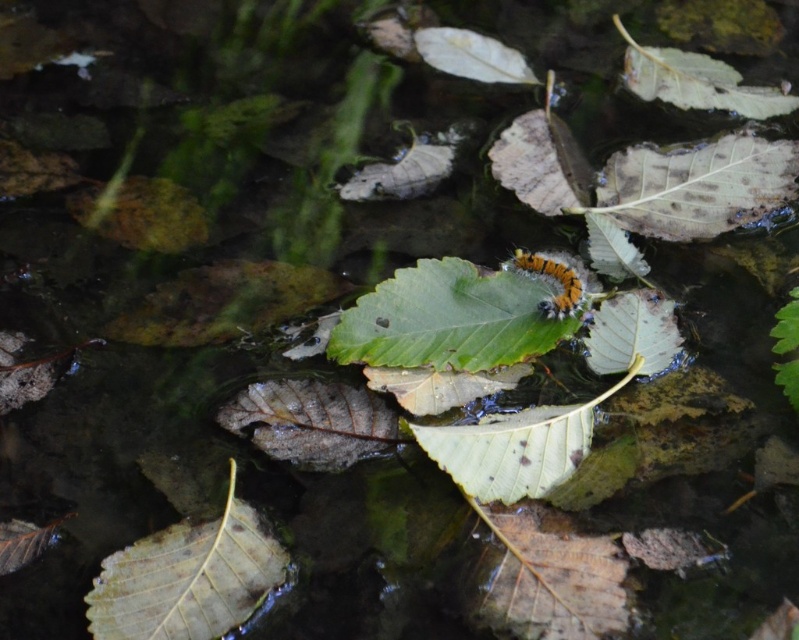
Is point (471, 342) more distant than point (521, 250)?

No, (471, 342) is closer to viewer.

Looking at this image, is green matte leaf at center shorter than tiger-striped fuzzy caterpillar at center?

In fact, green matte leaf at center may be taller than tiger-striped fuzzy caterpillar at center.

Image resolution: width=799 pixels, height=640 pixels. What do you see at coordinates (448, 320) in the screenshot? I see `green matte leaf at center` at bounding box center [448, 320].

Locate an element on the screen. Image resolution: width=799 pixels, height=640 pixels. green matte leaf at center is located at coordinates (448, 320).

Between point (411, 368) and point (280, 547), which one is positioned behind?

Point (411, 368)

Can you confirm if green matte leaf at center is positioned below green matte leaf at lower left?

Incorrect, green matte leaf at center is not positioned below green matte leaf at lower left.

Locate an element on the screen. Image resolution: width=799 pixels, height=640 pixels. green matte leaf at center is located at coordinates (448, 320).

Where is `green matte leaf at center`? This screenshot has width=799, height=640. green matte leaf at center is located at coordinates (448, 320).

Does green matte leaf at lower left appear over tiger-striped fuzzy caterpillar at center?

Incorrect, green matte leaf at lower left is not positioned above tiger-striped fuzzy caterpillar at center.

Can you confirm if green matte leaf at lower left is taller than tiger-striped fuzzy caterpillar at center?

Yes, green matte leaf at lower left is taller than tiger-striped fuzzy caterpillar at center.

Locate an element on the screen. The image size is (799, 640). green matte leaf at lower left is located at coordinates (189, 577).